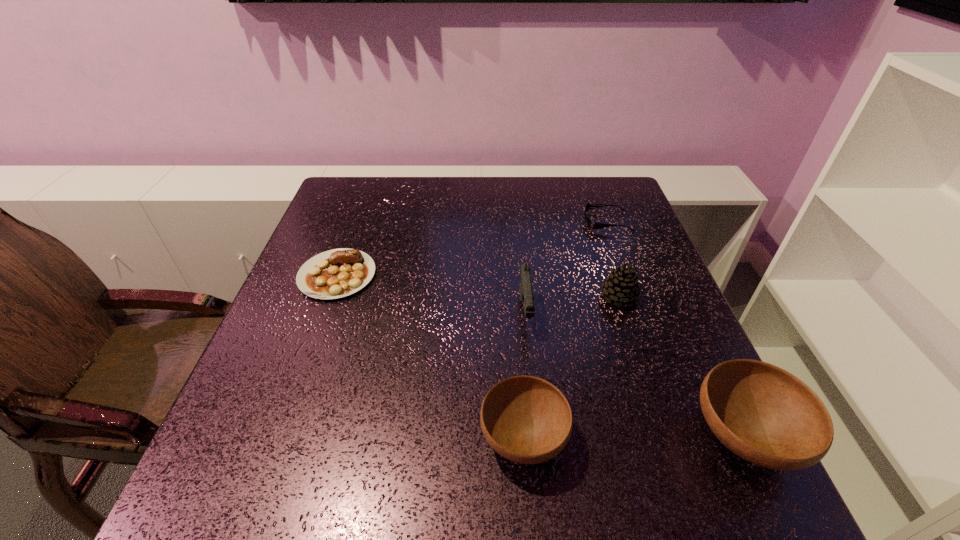
The image size is (960, 540). I want to click on the fourth tallest object, so click(526, 419).

This screenshot has height=540, width=960. Identify the location of the left bowl. (526, 419).

At what (x,y) coordinates should I click in order to perform the action: click on the taller bowl. Please return your answer as a coordinate pair (x, y). The height and width of the screenshot is (540, 960). Looking at the image, I should click on (x=762, y=413).

Locate an element on the screen. The width and height of the screenshot is (960, 540). the shortest object is located at coordinates (591, 225).

You are a GUI agent. You are given a task and a screenshot of the screen. Output one action in this format:
    pyautogui.click(x=<x>, y=<y>)
    Task: Click on the farthest object
    This screenshot has height=540, width=960.
    Given the screenshot: What is the action you would take?
    pyautogui.click(x=591, y=225)

What are the coordinates of `pistol` in the screenshot? It's located at (526, 292).

This screenshot has height=540, width=960. In order to click on steak in this screenshot , I will do `click(337, 273)`.

Locate an element on the screen. the fifth tallest object is located at coordinates (337, 273).

In order to click on pinecone in this screenshot , I will do `click(621, 286)`.

This screenshot has height=540, width=960. I want to click on free region located on the left of the third shortest object, so (300, 438).